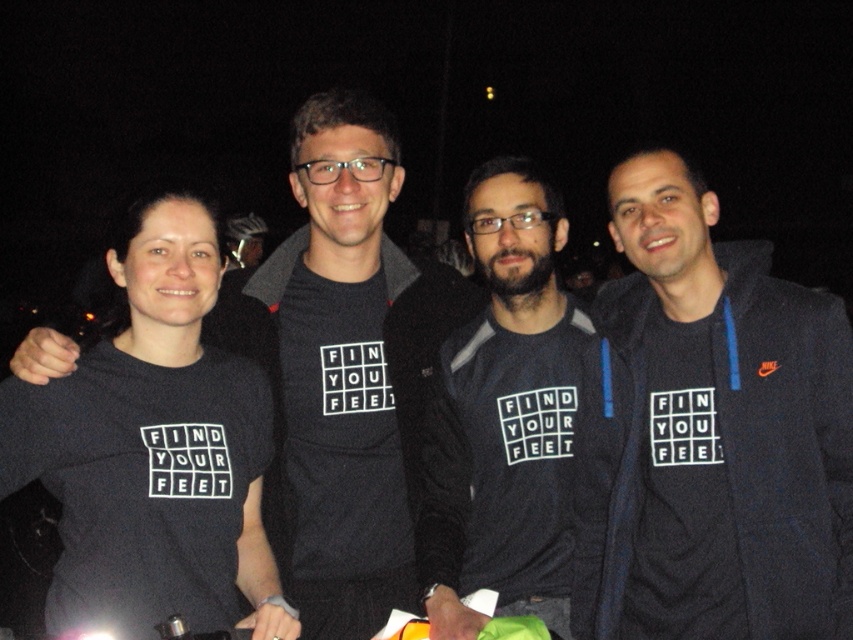
Question: Which object appears closest to the camera in this image?

Choices:
 (A) matte black t-shirt at center
 (B) dark gray sweatshirt at center
 (C) black fleece jacket at right

Answer: (B)

Question: Is matte black t-shirt at center wider than dark gray sweatshirt at center?

Choices:
 (A) yes
 (B) no

Answer: (A)

Question: Which object is the farthest from the matte black t-shirt at center?

Choices:
 (A) black fleece jacket at right
 (B) dark gray sweatshirt at center

Answer: (A)

Question: Can you confirm if black fleece jacket at right is smaller than dark gray sweatshirt at center?

Choices:
 (A) no
 (B) yes

Answer: (B)

Question: Which of the following is the farthest from the observer?

Choices:
 (A) (807, 632)
 (B) (502, 593)

Answer: (B)

Question: Is black fleece jacket at right in front of dark gray sweatshirt at center?

Choices:
 (A) yes
 (B) no

Answer: (B)